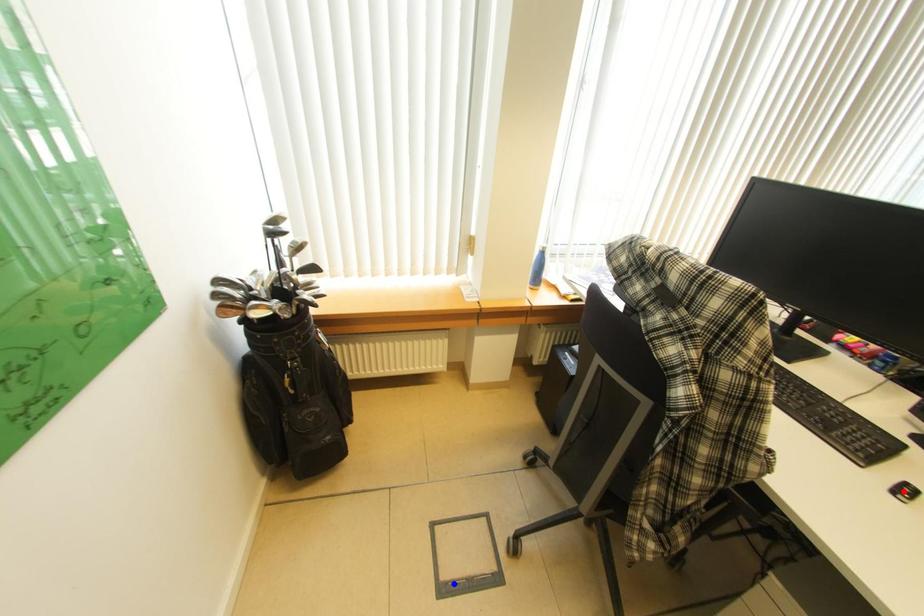
Question: Which of the two points in the image is closer to the camera?

Choices:
 (A) Blue point is closer.
 (B) Red point is closer.

Answer: (B)